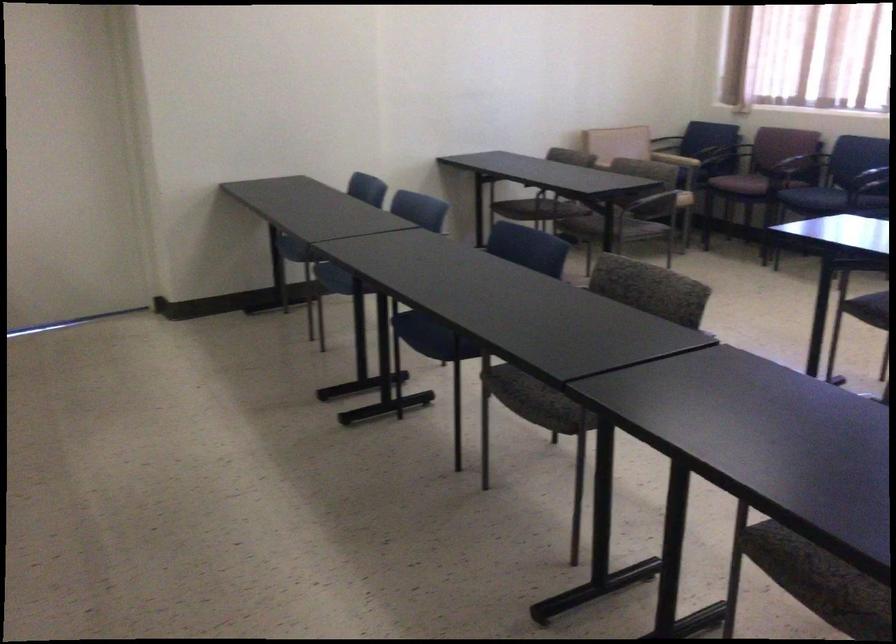
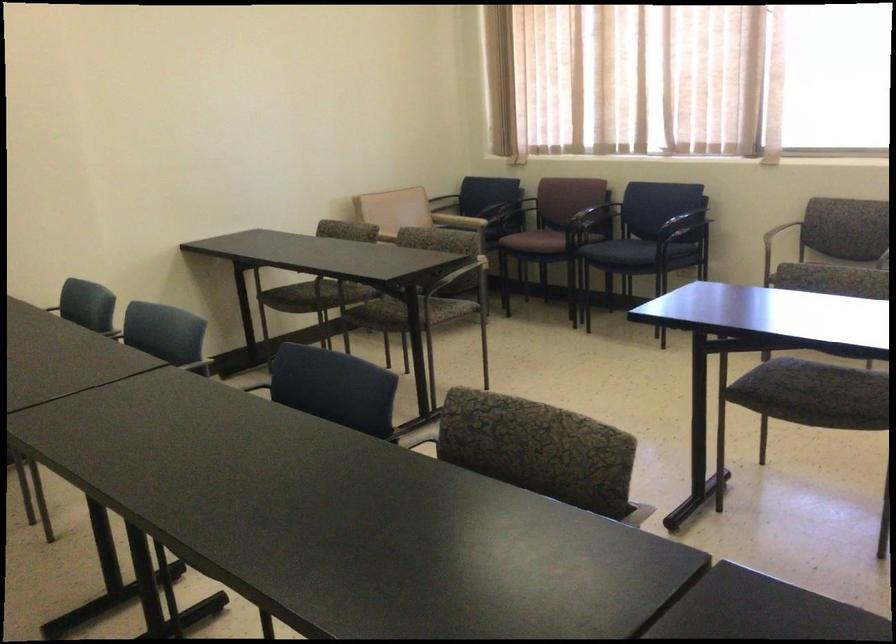
Question: I am providing you with two images of the same scene from different viewpoints. Please identify which objects are invisible in image2.

Choices:
 (A) black chair armrest
 (B) lever door handle
 (C) patterned chair sitting surface
 (D) purple chair armrest

Answer: (D)